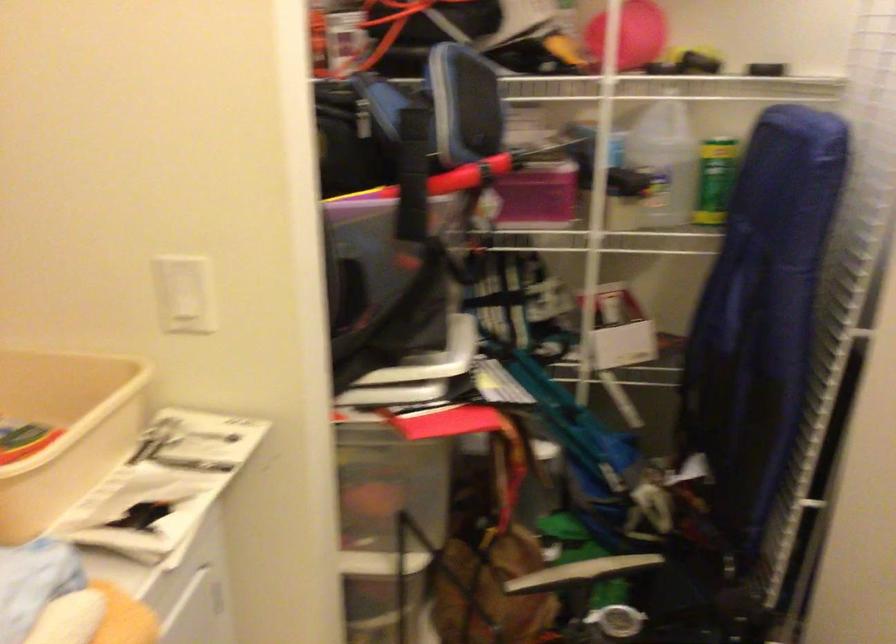
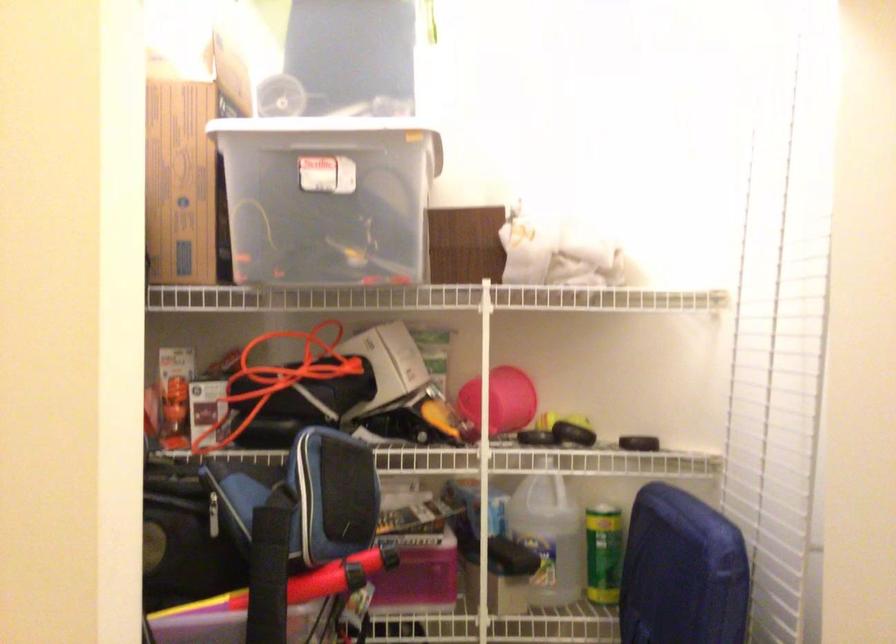
Locate, in the second image, the point that corresponds to pixel 714 178 in the first image.

(604, 554)